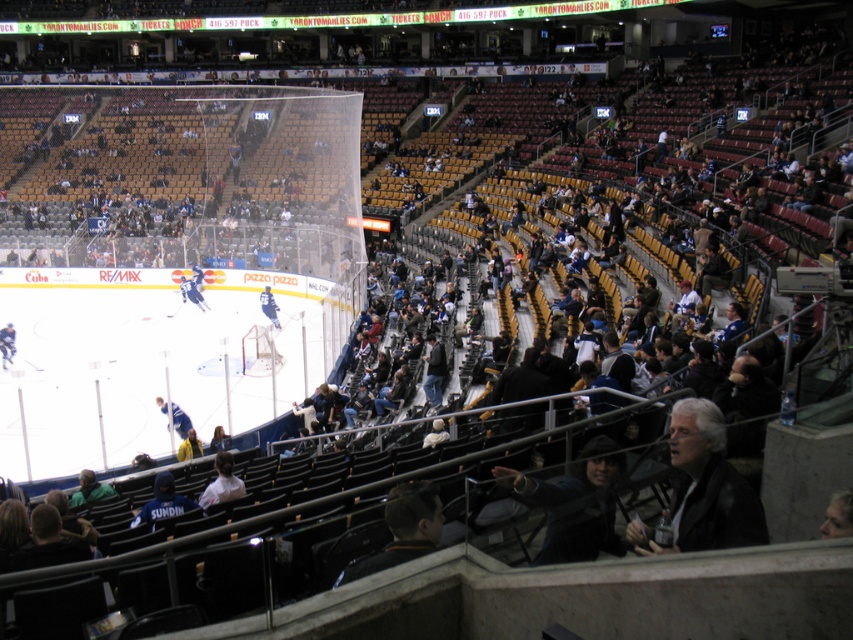
Is gray hair at center shorter than dark blue knit cap at lower left?

No.

In order to click on gray hair at center in this screenshot , I will do `click(704, 488)`.

Which is behind, point (718, 483) or point (178, 496)?

Point (178, 496)

Locate an element on the screen. Image resolution: width=853 pixels, height=640 pixels. gray hair at center is located at coordinates (704, 488).

Who is taller, dark blue knit cap at lower left or blue jersey at center?

Standing taller between the two is dark blue knit cap at lower left.

Locate an element on the screen. The width and height of the screenshot is (853, 640). dark blue knit cap at lower left is located at coordinates (161, 500).

What are the coordinates of `dark blue knit cap at lower left` in the screenshot? It's located at (161, 500).

Does dark blue knit cap at lower left appear under blue hockey stick at center?

Indeed, dark blue knit cap at lower left is positioned under blue hockey stick at center.

Can you confirm if dark blue knit cap at lower left is smaller than blue hockey stick at center?

Yes.

The height and width of the screenshot is (640, 853). Describe the element at coordinates (161, 500) in the screenshot. I see `dark blue knit cap at lower left` at that location.

What are the coordinates of `dark blue knit cap at lower left` in the screenshot? It's located at (161, 500).